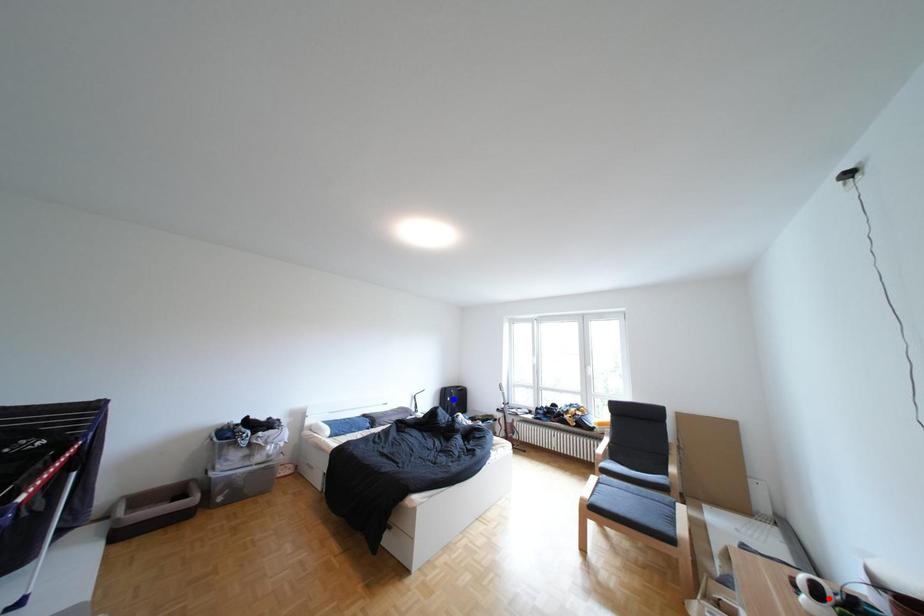
Question: In the image, two points are highlighted. Which point is nearer to the camera? Reply with the corresponding letter.

Choices:
 (A) blue point
 (B) red point

Answer: (B)